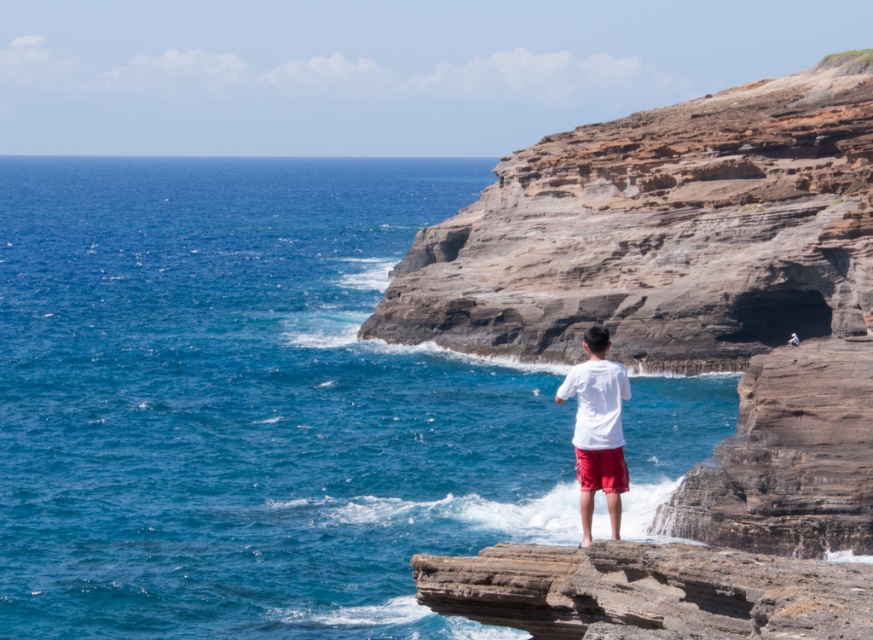
Based on the photo, you are standing at the base of the cliffs and want to reach the point marked at coordinates (657,472). Given that the distance is 57.38 meters, can you estimate how long it would take to walk there at a normal pace?

The point at coordinates (657,472) is 57.38 meters away from the viewer. At a normal walking pace of approximately 1.4 meters per second, it would take about 41 seconds to reach the point.